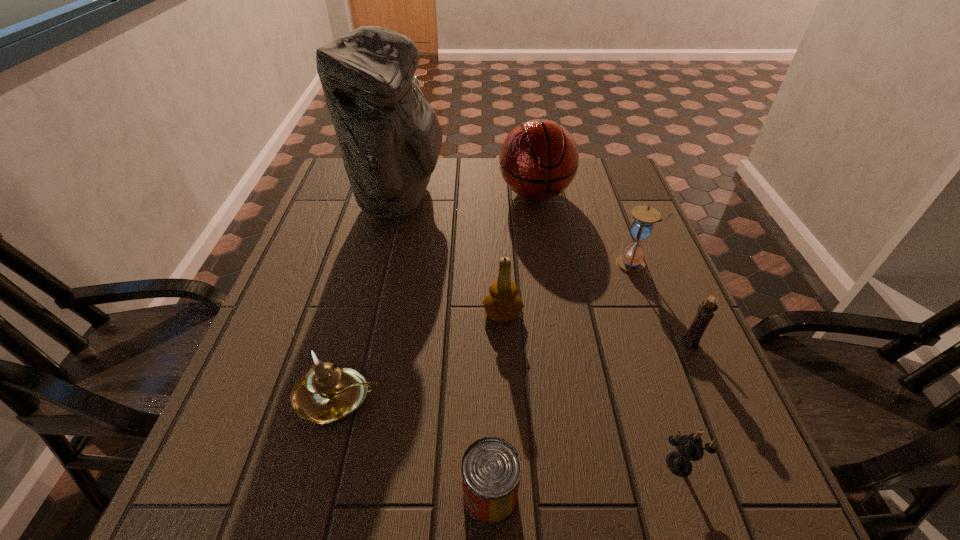
Where is `the nearest candle holder`? The width and height of the screenshot is (960, 540). the nearest candle holder is located at coordinates (689, 448).

Locate an element on the screen. can is located at coordinates (491, 468).

You are a GUI agent. You are given a task and a screenshot of the screen. Output one action in this format:
    pyautogui.click(x=<x>, y=<y>)
    Task: Click on the vacant space positioned 0.080m on the front-facing side of the backpack
    This screenshot has width=960, height=540.
    Given the screenshot: What is the action you would take?
    pyautogui.click(x=471, y=198)

The image size is (960, 540). What are the coordinates of `vacant space situated 0.300m on the side with spill of the seventh shortest object` in the screenshot? It's located at (551, 293).

Image resolution: width=960 pixels, height=540 pixels. I want to click on vacant space located on the front of the sixth nearest object, so click(x=647, y=302).

I want to click on blank space located 0.280m on the right of the farthest candle holder, so click(650, 313).

This screenshot has height=540, width=960. I want to click on free space located on the handle side of the third farthest candle holder, so click(x=563, y=397).

Locate an element on the screen. vacant space located 0.240m on the front of the rightmost candle holder is located at coordinates (743, 465).

Locate an element on the screen. blank space located 0.400m on the back of the nearest candle holder is located at coordinates (621, 285).

Where is `blank area located 0.140m on the right of the can`? This screenshot has width=960, height=540. blank area located 0.140m on the right of the can is located at coordinates (606, 495).